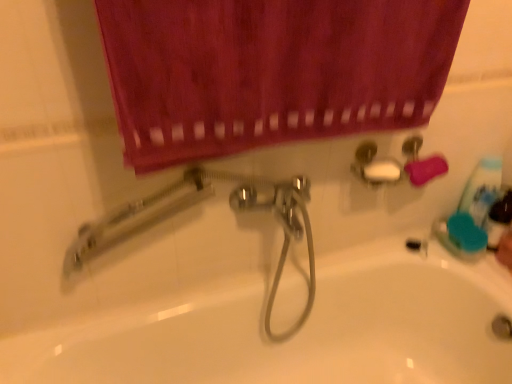
Question: Looking at their shapes, would you say smooth skin hand at lower right is wider or thinner than blue plastic mouthwash at right?

Choices:
 (A) wide
 (B) thin

Answer: (A)

Question: From the image's perspective, is smooth skin hand at lower right positioned above or below blue plastic mouthwash at right?

Choices:
 (A) above
 (B) below

Answer: (B)

Question: Based on their relative distances, which object is farther from the smooth skin hand at lower right?

Choices:
 (A) white glossy bathtub at center
 (B) blue plastic mouthwash at right
 (C) velvet-like maroon curtain at upper center

Answer: (C)

Question: Considering the real-world distances, which object is farthest from the velvet-like maroon curtain at upper center?

Choices:
 (A) white glossy bathtub at center
 (B) smooth skin hand at lower right
 (C) blue plastic mouthwash at right

Answer: (B)